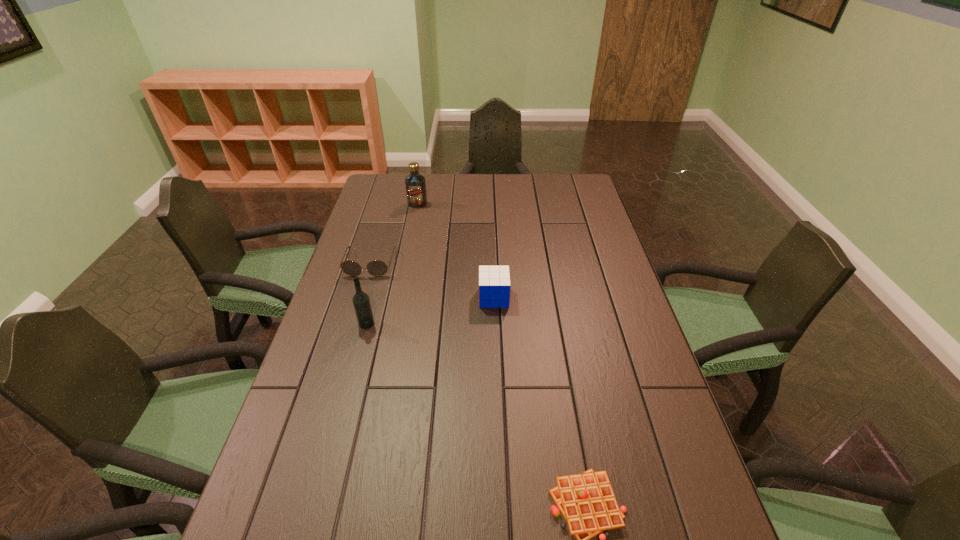
Locate an element on the screen. The height and width of the screenshot is (540, 960). empty location between the third object from left to right and the second nearest object is located at coordinates (392, 264).

Where is `vacant space in between the farther vodka and the second farthest object`? The image size is (960, 540). vacant space in between the farther vodka and the second farthest object is located at coordinates (394, 234).

This screenshot has width=960, height=540. Find the location of `empty space that is in between the nearer vodka and the third tallest object`. empty space that is in between the nearer vodka and the third tallest object is located at coordinates (430, 310).

Find the location of a particular element. Image resolution: width=960 pixels, height=540 pixels. vacant space that's between the third farthest object and the second nearest object is located at coordinates (430, 310).

Where is `vacant area between the second shortest object and the third nearest object`? The image size is (960, 540). vacant area between the second shortest object and the third nearest object is located at coordinates (432, 281).

Locate an element on the screen. The height and width of the screenshot is (540, 960). vacant space that's between the sunglasses and the farthest object is located at coordinates (394, 234).

Point out which object is positioned as the second nearest to the shortest object. Please provide its 2D coordinates. Your answer should be formatted as a tuple, i.e. [(x, y)], where the tuple contains the x and y coordinates of a point satisfying the conditions above.

[(361, 301)]

Locate which object is the third closest to the sunglasses. Please provide its 2D coordinates. Your answer should be formatted as a tuple, i.e. [(x, y)], where the tuple contains the x and y coordinates of a point satisfying the conditions above.

[(494, 281)]

This screenshot has width=960, height=540. Find the location of `free location that satisfies the following two spatial constraints: 1. on the lenses of the second farthest object; 2. on the left side of the cube`. free location that satisfies the following two spatial constraints: 1. on the lenses of the second farthest object; 2. on the left side of the cube is located at coordinates (360, 298).